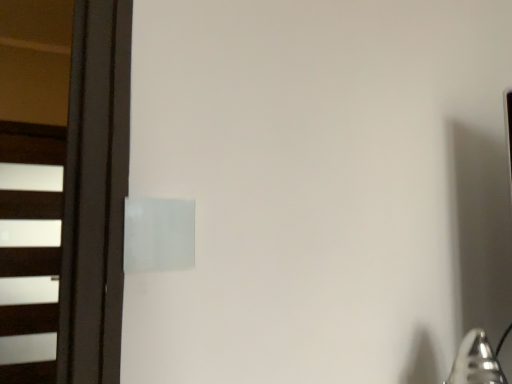
The image size is (512, 384). What do you see at coordinates (477, 360) in the screenshot? I see `metallic silver iron at lower right` at bounding box center [477, 360].

What is the approximate height of metallic silver iron at lower right?

The height of metallic silver iron at lower right is 21.08 centimeters.

Locate an element on the screen. metallic silver iron at lower right is located at coordinates (477, 360).

Measure the distance between point (496,360) and camera.

The distance of point (496,360) from camera is 29.29 inches.

Identify the location of metallic silver iron at lower right. This screenshot has height=384, width=512. (477, 360).